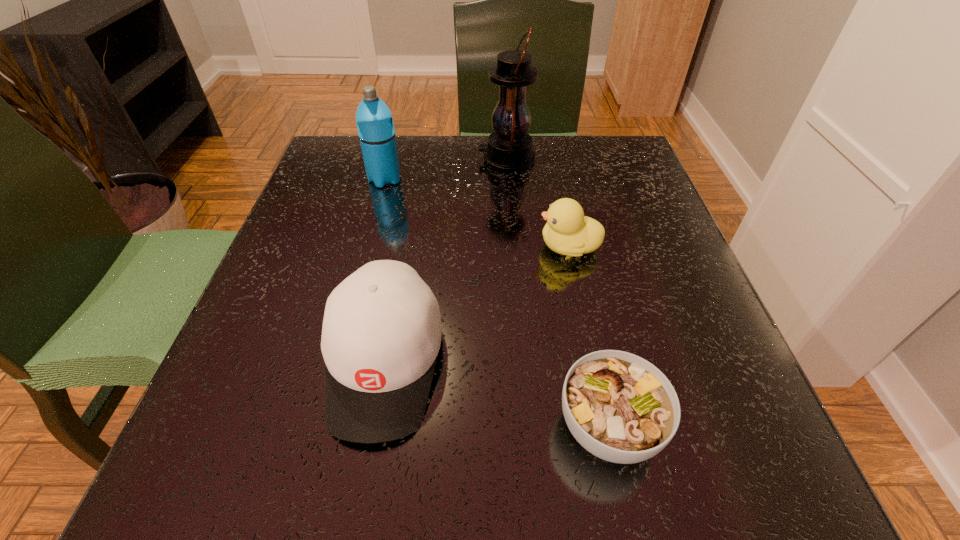
At what (x,y) coordinates should I click in order to perform the action: click on object identified as the fourth closest to the shortest object. Please return your answer as a coordinate pair (x, y). Looking at the image, I should click on (374, 120).

Point out which object is positioned as the second nearest to the lantern. Please provide its 2D coordinates. Your answer should be formatted as a tuple, i.e. [(x, y)], where the tuple contains the x and y coordinates of a point satisfying the conditions above.

[(568, 232)]

Find the location of `free space that satisfies the following two spatial constraints: 1. at the beak of the duckling; 2. on the front-facing side of the baseball cap`. free space that satisfies the following two spatial constraints: 1. at the beak of the duckling; 2. on the front-facing side of the baseball cap is located at coordinates (593, 362).

Where is `vacant space that satisfies the following two spatial constraints: 1. above the lantern, indicating its light source; 2. on the front side of the second tallest object`? Image resolution: width=960 pixels, height=540 pixels. vacant space that satisfies the following two spatial constraints: 1. above the lantern, indicating its light source; 2. on the front side of the second tallest object is located at coordinates (509, 179).

Locate an element on the screen. The height and width of the screenshot is (540, 960). vacant point that satisfies the following two spatial constraints: 1. on the front-facing side of the baseball cap; 2. on the left side of the shortest object is located at coordinates (373, 427).

Identify the location of free space that satisfies the following two spatial constraints: 1. above the tallest object, indicating its light source; 2. on the back side of the shortest object. Image resolution: width=960 pixels, height=540 pixels. [528, 427].

This screenshot has height=540, width=960. In order to click on vacant area in the image that satisfies the following two spatial constraints: 1. above the lantern, indicating its light source; 2. on the front-facing side of the baseball cap in this screenshot , I will do `click(523, 362)`.

Where is `free location that satisfies the following two spatial constraints: 1. above the lantern, indicating its light source; 2. on the front-facing side of the third shortest object`? free location that satisfies the following two spatial constraints: 1. above the lantern, indicating its light source; 2. on the front-facing side of the third shortest object is located at coordinates (523, 362).

Locate an element on the screen. vacant area in the image that satisfies the following two spatial constraints: 1. above the shortest object, indicating its light source; 2. on the right side of the lantern is located at coordinates (528, 427).

Image resolution: width=960 pixels, height=540 pixels. I want to click on vacant space that satisfies the following two spatial constraints: 1. on the front side of the shortest object; 2. on the right side of the thermos bottle, so click(x=320, y=427).